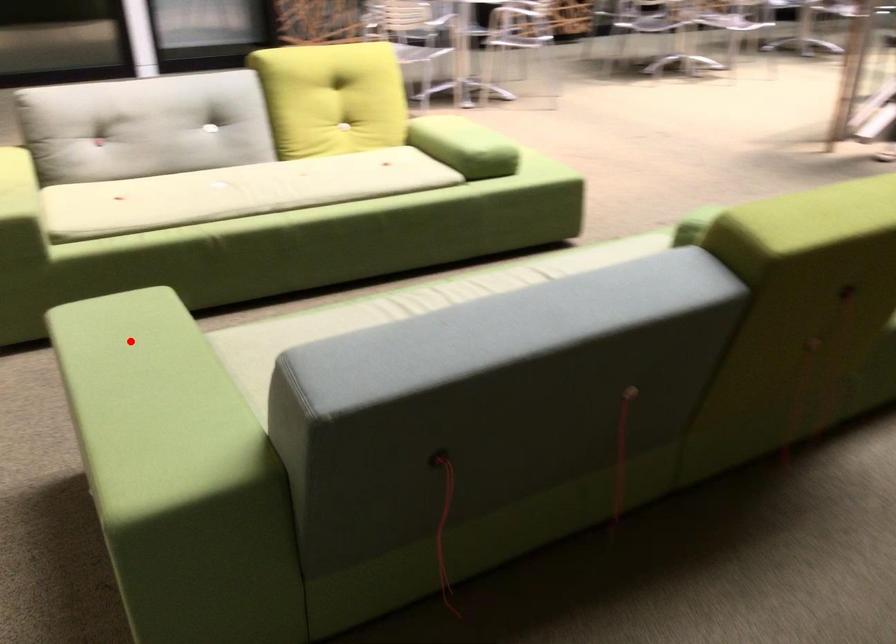
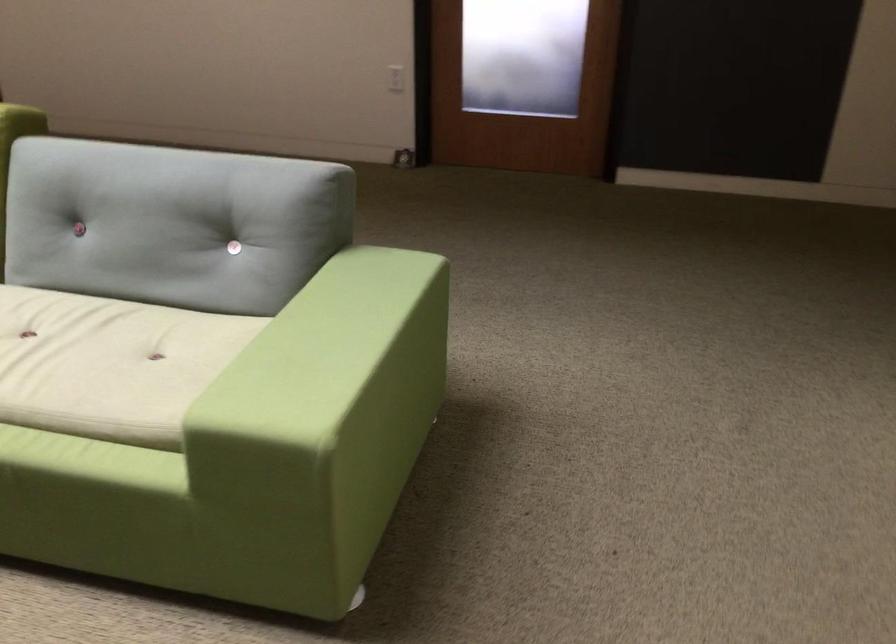
The point at the highlighted location is marked in the first image. Where is the corresponding point in the second image?

(323, 353)